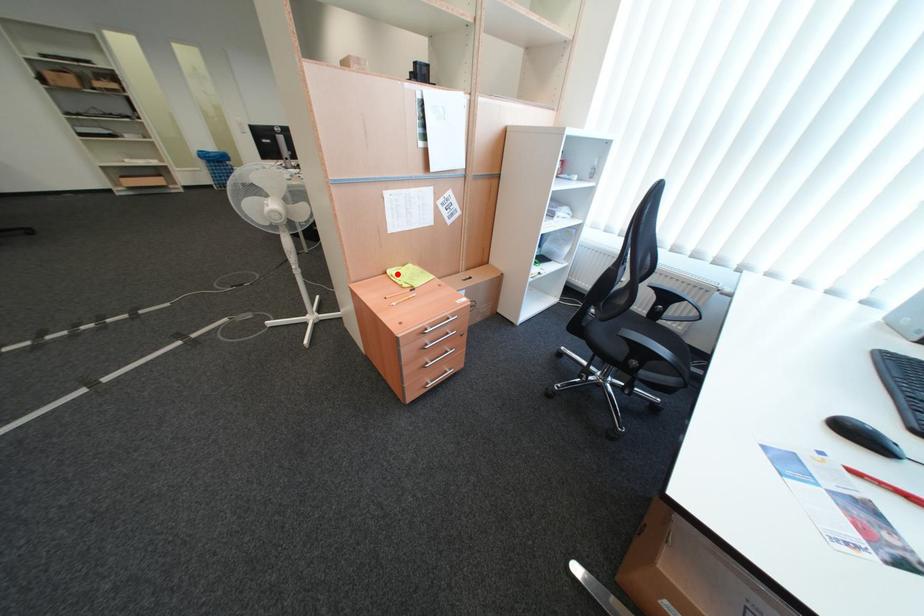
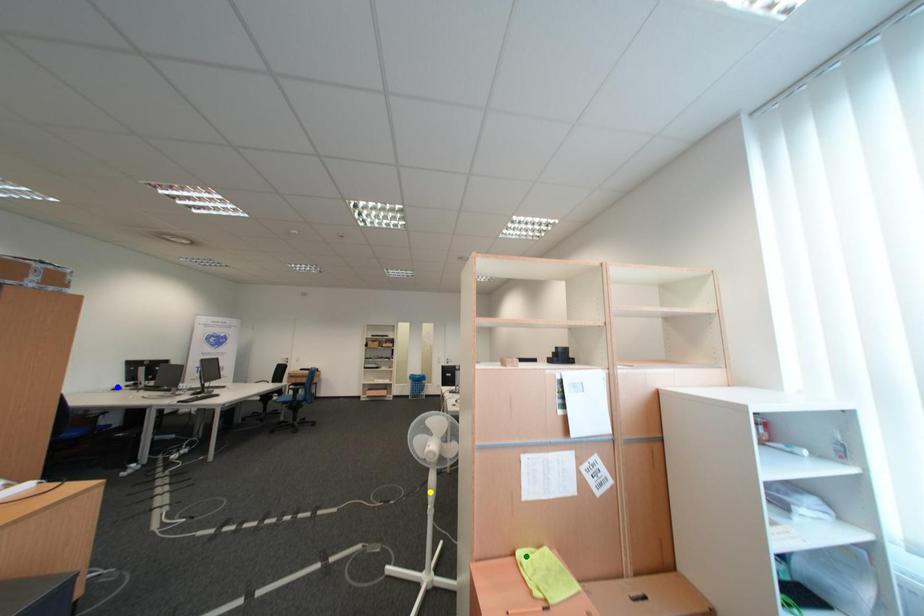
Question: I am providing you with two images of the same scene from different viewpoints. A red point is marked on the first image. You are given multiple points on the second image. Which point in image 2 is actually the same real-world point as the red point in image 1?

Choices:
 (A) green point
 (B) yellow point
 (C) blue point

Answer: (A)